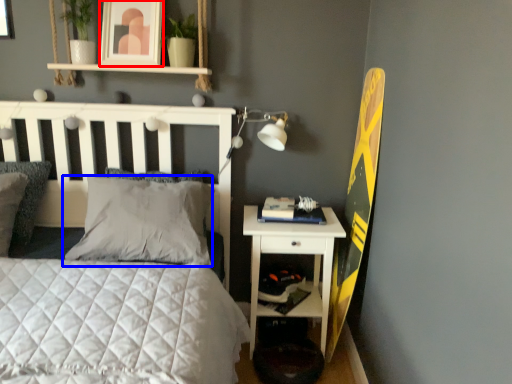
Question: Which object is further to the camera taking this photo, picture frame (highlighted by a red box) or pillow (highlighted by a blue box)?

Choices:
 (A) picture frame
 (B) pillow

Answer: (A)